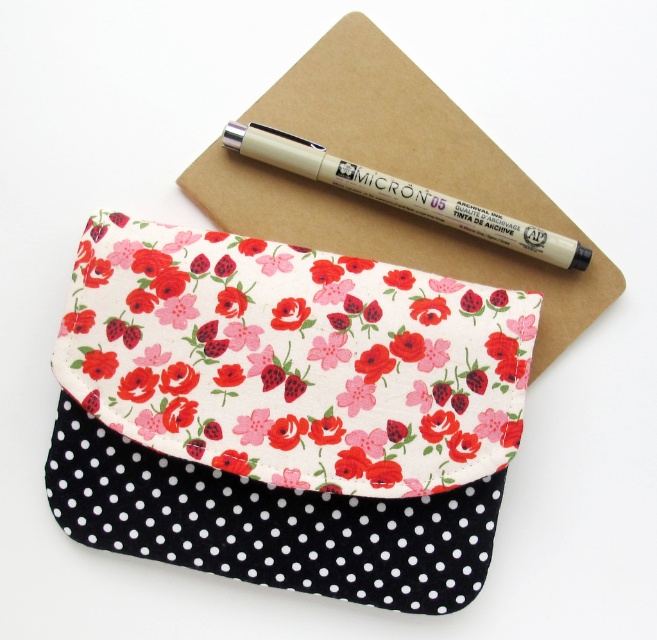
Question: Does matte beige pen at upper center have a lesser width compared to floral fabric flower at center?

Choices:
 (A) yes
 (B) no

Answer: (B)

Question: Which of the following is the farthest from the observer?

Choices:
 (A) (283, 300)
 (B) (501, 234)
 (C) (409, 282)
 (D) (457, 589)

Answer: (B)

Question: Which of these objects is positioned farthest from the floral fabric pouch at center?

Choices:
 (A) floral fabric notepad at upper center
 (B) floral fabric flower at center
 (C) floral fabric flower at upper center

Answer: (C)

Question: Can you confirm if floral fabric notepad at upper center is positioned below floral fabric flower at center?

Choices:
 (A) yes
 (B) no

Answer: (B)

Question: Which object is farther from the camera taking this photo?

Choices:
 (A) matte beige pen at upper center
 (B) floral fabric flower at upper center
 (C) floral fabric pouch at center

Answer: (A)

Question: Does matte beige pen at upper center appear under floral fabric flower at center?

Choices:
 (A) yes
 (B) no

Answer: (B)